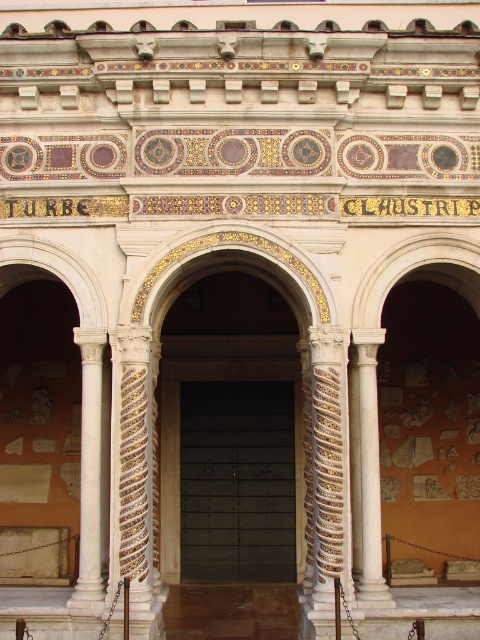
Question: Which is nearer to the white marble column at center?

Choices:
 (A) white marble archway at center
 (B) white marble column at left
 (C) black metal door at center

Answer: (A)

Question: Can you confirm if black metal door at center is positioned to the left of white marble column at center?

Choices:
 (A) no
 (B) yes

Answer: (B)

Question: Which of these objects is positioned closest to the white marble column at center?

Choices:
 (A) white marble column at left
 (B) black metal door at center

Answer: (A)

Question: Can you confirm if white marble archway at center is positioned to the right of white marble column at left?

Choices:
 (A) no
 (B) yes

Answer: (B)

Question: Does white marble column at left have a greater width compared to white marble column at center?

Choices:
 (A) yes
 (B) no

Answer: (A)

Question: Considering the real-world distances, which object is farthest from the black metal door at center?

Choices:
 (A) white marble archway at center
 (B) white marble column at center

Answer: (B)